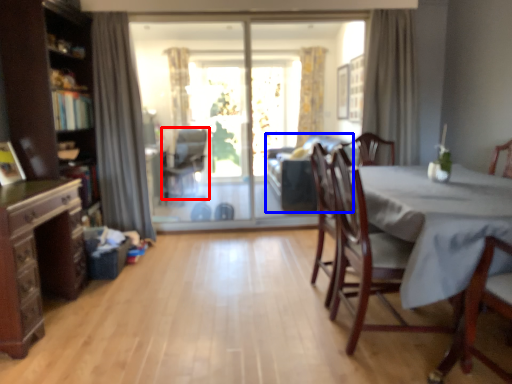
Question: Among these objects, which one is farthest to the camera, chair (highlighted by a red box) or couch (highlighted by a blue box)?

Choices:
 (A) chair
 (B) couch

Answer: (A)